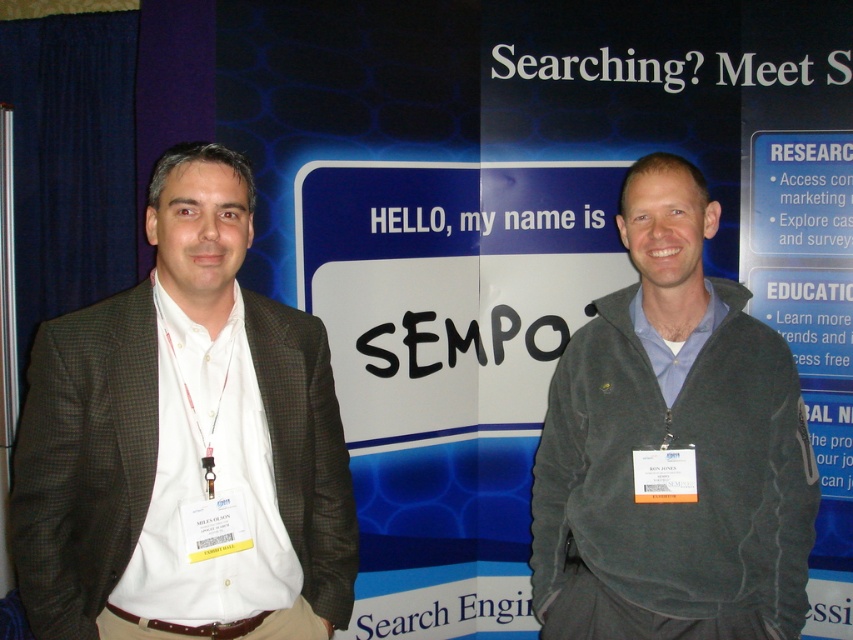
Question: Estimate the real-world distances between objects in this image. Which object is closer to the blue fabric banner at center?

Choices:
 (A) matte black suit at left
 (B) dark gray fleece jacket at right

Answer: (A)

Question: Does blue fabric banner at center lie in front of matte black suit at left?

Choices:
 (A) yes
 (B) no

Answer: (B)

Question: From the image, what is the correct spatial relationship of blue fabric banner at center in relation to matte black suit at left?

Choices:
 (A) right
 (B) left

Answer: (A)

Question: Considering the real-world distances, which object is closest to the dark gray fleece jacket at right?

Choices:
 (A) matte black suit at left
 (B) blue fabric banner at center

Answer: (A)

Question: Which point is closer to the camera taking this photo?

Choices:
 (A) (99, 307)
 (B) (461, 346)
 (C) (637, 500)

Answer: (A)

Question: Is blue fabric banner at center closer to camera compared to matte black suit at left?

Choices:
 (A) no
 (B) yes

Answer: (A)